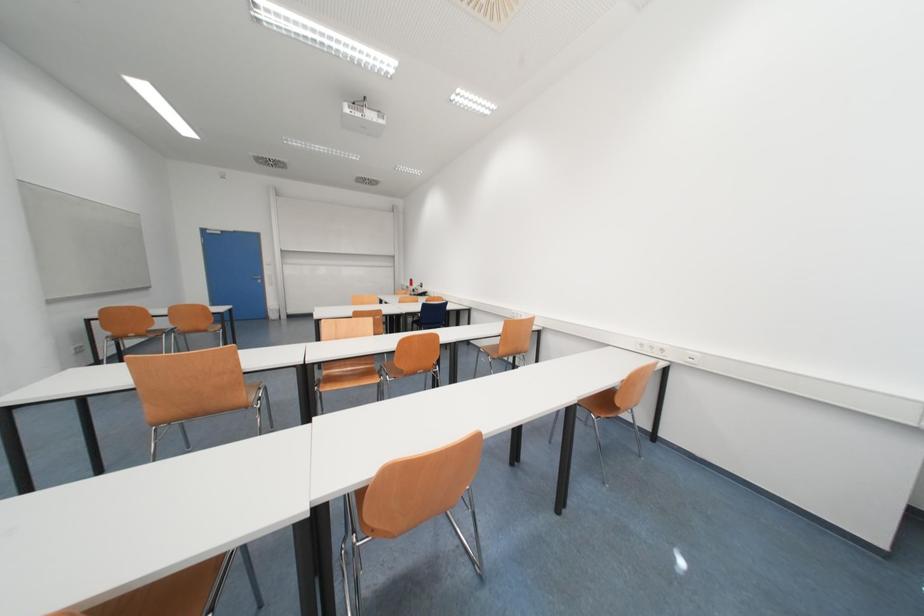
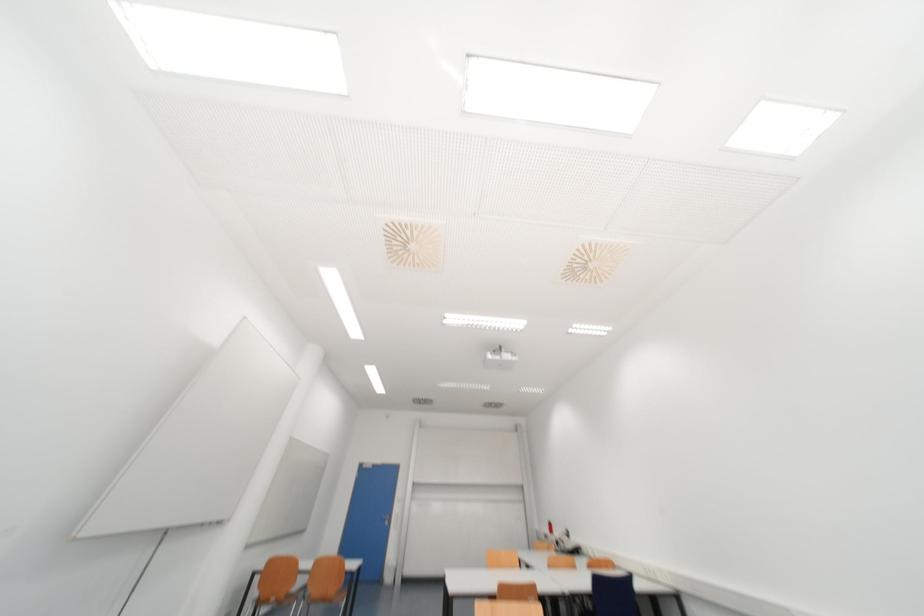
The images are taken continuously from a first-person perspective. In which direction is your viewpoint rotating?

The rotation direction of the camera is left-up.